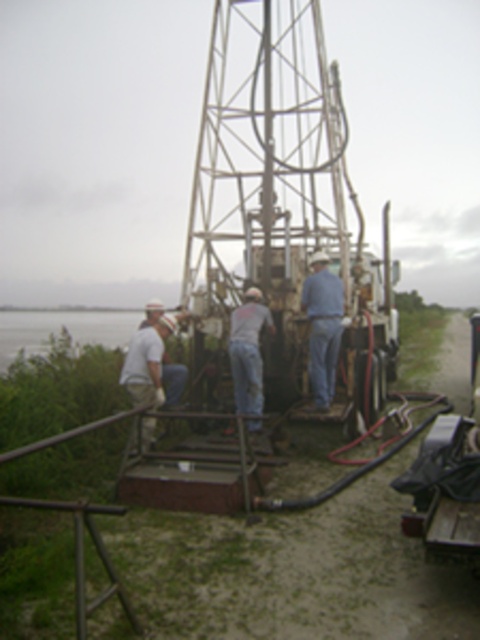
Question: Does blue jeans at center have a lesser width compared to white matte shirt at left?

Choices:
 (A) no
 (B) yes

Answer: (B)

Question: Which point is farther to the camera?

Choices:
 (A) white matte shirt at left
 (B) blue jeans at center
 (C) gray denim jeans at center

Answer: (B)

Question: Which of the following is the farthest from the observer?

Choices:
 (A) (326, 368)
 (B) (238, 326)
 (C) (129, 358)

Answer: (A)

Question: Is gray denim jeans at center smaller than white matte shirt at left?

Choices:
 (A) yes
 (B) no

Answer: (A)

Question: Estimate the real-world distances between objects in this image. Which object is farther from the blue jeans at center?

Choices:
 (A) gray denim jeans at center
 (B) white matte shirt at left

Answer: (B)

Question: Can you confirm if blue jeans at center is bigger than gray denim jeans at center?

Choices:
 (A) yes
 (B) no

Answer: (A)